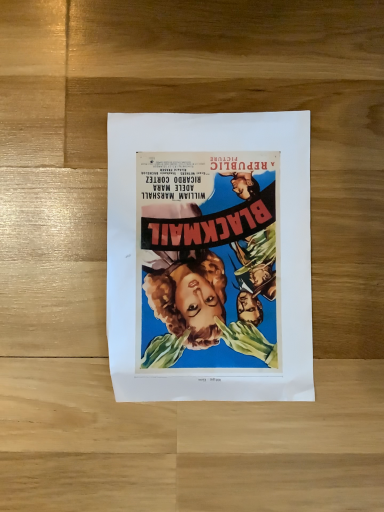
At what (x,y) coordinates should I click in order to perform the action: click on empty space that is ontop of matte paper poster at center (from a real-world perspective). Please return your answer as a coordinate pair (x, y). This screenshot has width=384, height=512. Looking at the image, I should click on (211, 258).